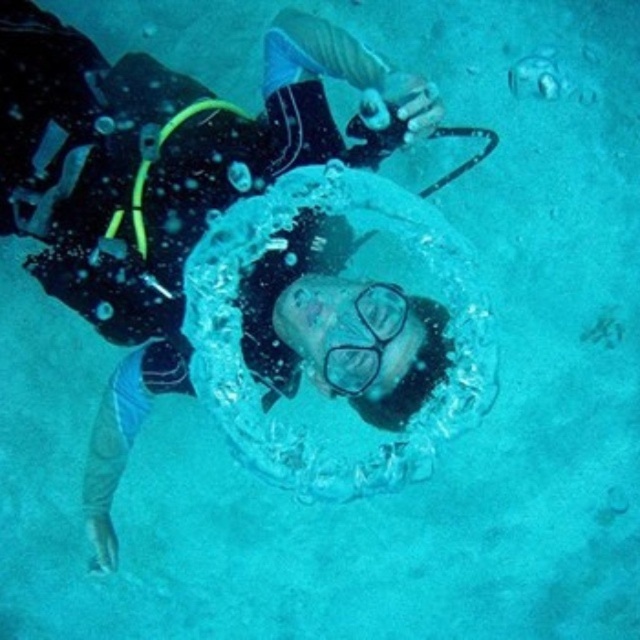
Question: From the image, what is the correct spatial relationship of transparent water at center in relation to clear plastic goggles at center?

Choices:
 (A) right
 (B) left

Answer: (A)

Question: Is transparent water at center above clear plastic goggles at center?

Choices:
 (A) yes
 (B) no

Answer: (A)

Question: Is transparent water at center smaller than clear plastic goggles at center?

Choices:
 (A) no
 (B) yes

Answer: (A)

Question: Among these points, which one is farthest from the camera?

Choices:
 (A) (374, 365)
 (B) (365, 307)

Answer: (B)